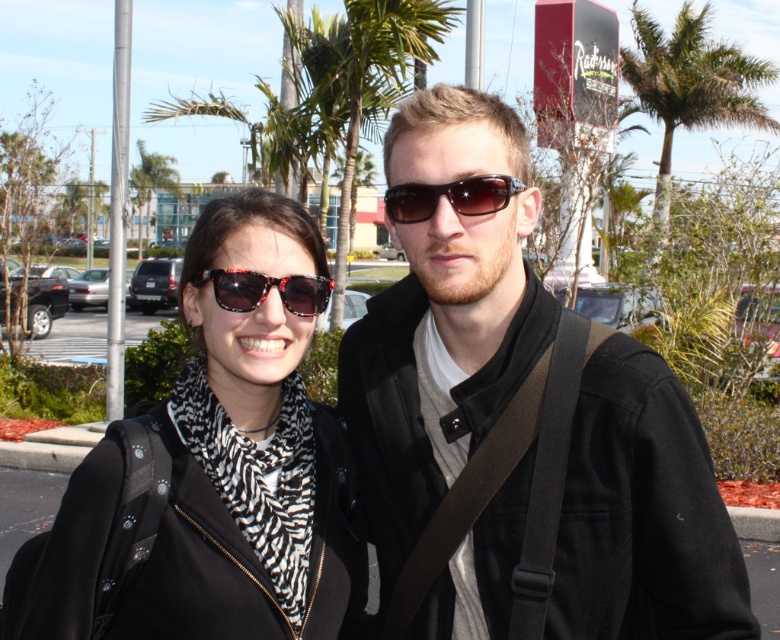
This screenshot has height=640, width=780. I want to click on matte black jacket at center, so click(429, 365).

Between point (477, 420) and point (700, 45), which one is positioned in front?

Point (477, 420) is more forward.

Where is `matte black jacket at center`? This screenshot has width=780, height=640. matte black jacket at center is located at coordinates (429, 365).

Does zebra-patterned scarf at left have a smaller size compared to black plastic sunglasses at center?

No, zebra-patterned scarf at left is not smaller than black plastic sunglasses at center.

Can you confirm if zebra-patterned scarf at left is thinner than black plastic sunglasses at center?

No.

Where is `zebra-patterned scarf at left`? zebra-patterned scarf at left is located at coordinates (250, 458).

Is green leafy palm tree at upper center in front of black plastic sunglasses at center?

No, green leafy palm tree at upper center is further to the viewer.

Which of these two, green leafy palm tree at upper center or black plastic sunglasses at center, stands shorter?

black plastic sunglasses at center is shorter.

Does point (658, 115) come farther from viewer compared to point (463, 198)?

Yes, point (658, 115) is behind point (463, 198).

This screenshot has width=780, height=640. Find the location of `green leafy palm tree at upper center`. green leafy palm tree at upper center is located at coordinates (690, 84).